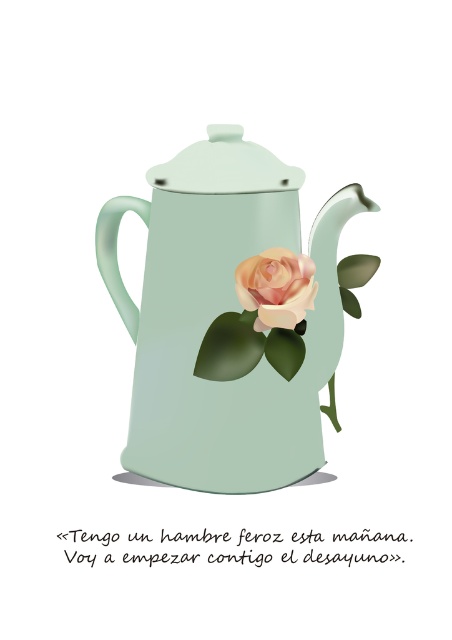
Question: Which of the following is the closest to the observer?

Choices:
 (A) peach glossy rose at center
 (B) matte ceramic teapot at center
 (C) matte green lid at upper center

Answer: (A)

Question: Is matte green lid at upper center wider than peach glossy rose at center?

Choices:
 (A) no
 (B) yes

Answer: (B)

Question: Can you confirm if matte green lid at upper center is positioned above peach glossy rose at center?

Choices:
 (A) yes
 (B) no

Answer: (A)

Question: Based on their relative distances, which object is nearer to the peach glossy rose at center?

Choices:
 (A) matte ceramic teapot at center
 (B) matte green lid at upper center

Answer: (A)

Question: Can you confirm if matte green lid at upper center is positioned to the left of peach glossy rose at center?

Choices:
 (A) yes
 (B) no

Answer: (A)

Question: Among these objects, which one is nearest to the camera?

Choices:
 (A) matte ceramic teapot at center
 (B) peach glossy rose at center

Answer: (B)